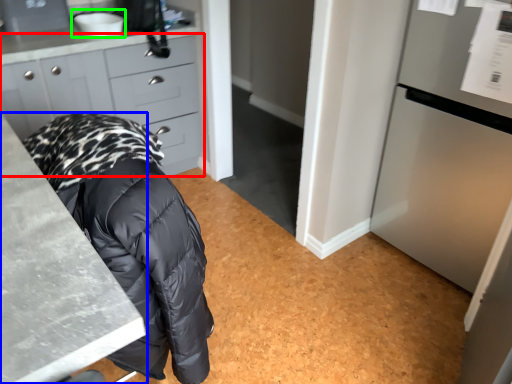
Question: Which object is positioned farthest from cabinetry (highlighted by a red box)? Select from countertop (highlighted by a blue box) and sink (highlighted by a green box).

Choices:
 (A) countertop
 (B) sink

Answer: (A)